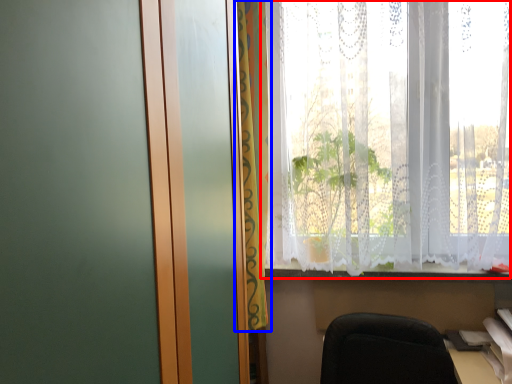
Question: Which point is closer to the camera, window (highlighted by a red box) or curtain (highlighted by a blue box)?

Choices:
 (A) window
 (B) curtain

Answer: (A)